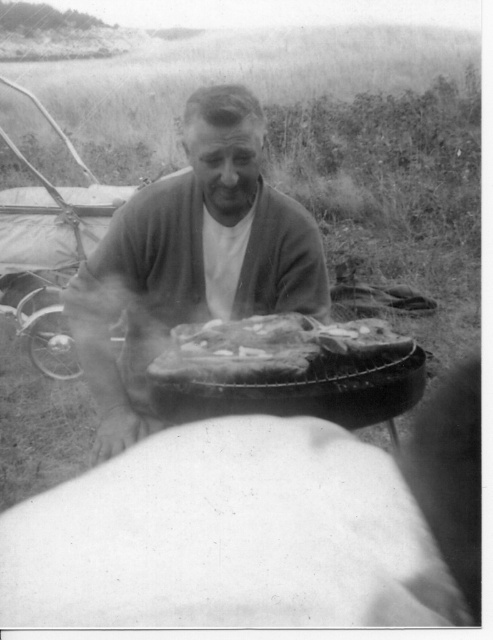
Can you confirm if smooth leather jacket at center is smaller than charred wooden platter at center?

No.

Can you confirm if smooth leather jacket at center is shorter than charred wooden platter at center?

Incorrect, smooth leather jacket at center's height does not fall short of charred wooden platter at center's.

Locate an element on the screen. This screenshot has height=640, width=493. smooth leather jacket at center is located at coordinates (191, 259).